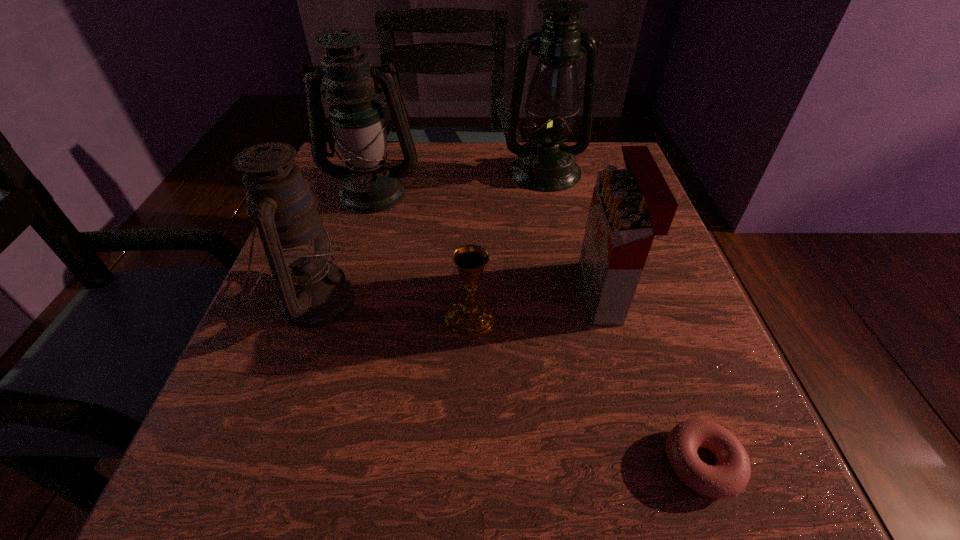
Identify the location of the rightmost oil lamp. (545, 164).

Find the location of a particular element. Image resolution: width=960 pixels, height=540 pixels. the nearest oil lamp is located at coordinates (314, 292).

Where is `the shortest oil lamp`? the shortest oil lamp is located at coordinates 314,292.

At what (x,y) coordinates should I click in order to perform the action: click on the fourth tallest object. Please return your answer as a coordinate pair (x, y). Looking at the image, I should click on (630, 206).

Identify the location of the second shortest object. The image size is (960, 540). (471, 317).

Find the location of a particular element. the fourth object from right to left is located at coordinates (471, 317).

Identify the location of the nearest object. This screenshot has height=540, width=960. (729, 477).

The height and width of the screenshot is (540, 960). Find the location of `the shortest object`. the shortest object is located at coordinates (729, 477).

Identify the location of vacant point located 0.330m on the left of the rightmost oil lamp. (366, 171).

The height and width of the screenshot is (540, 960). Find the location of `free space located on the back of the shortest oil lamp`. free space located on the back of the shortest oil lamp is located at coordinates (360, 171).